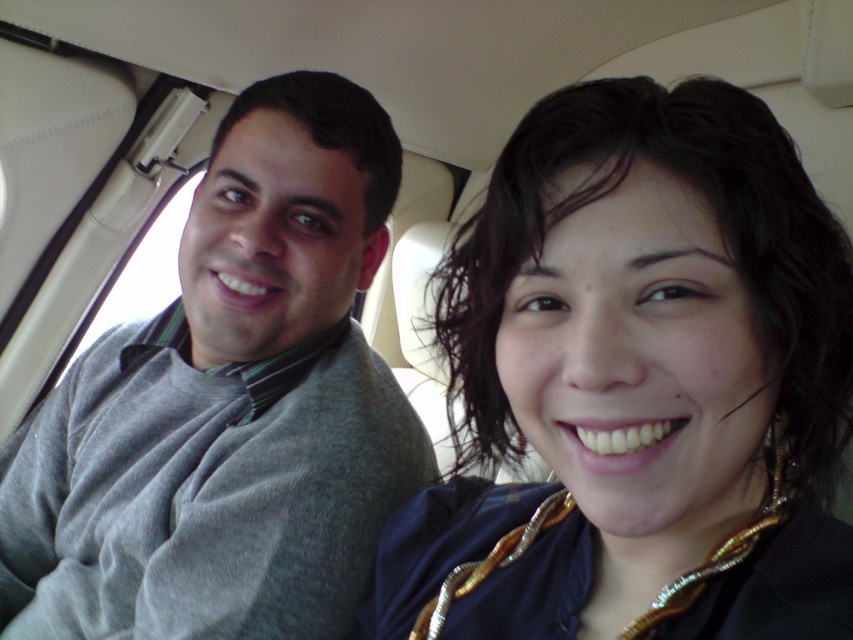
What do you see at coordinates (637, 385) in the screenshot? I see `dark blue fabric at center` at bounding box center [637, 385].

Is dark blue fabric at center smaller than gray sweater at left?

Indeed, dark blue fabric at center has a smaller size compared to gray sweater at left.

Describe the element at coordinates (637, 385) in the screenshot. I see `dark blue fabric at center` at that location.

Where is `dark blue fabric at center`? This screenshot has height=640, width=853. dark blue fabric at center is located at coordinates (637, 385).